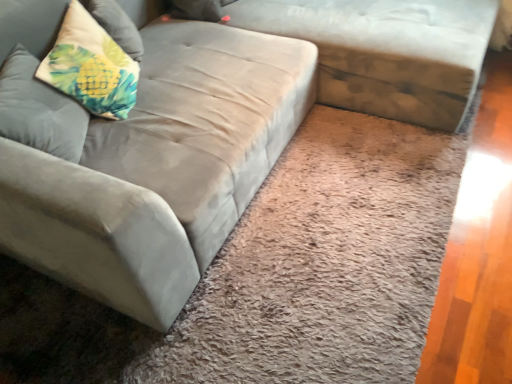
Question: Visually, is textured beige pillow at upper left, the first pillow viewed from the top, positioned to the left or to the right of suede gray couch at center?

Choices:
 (A) left
 (B) right

Answer: (A)

Question: From the image's perspective, is textured beige pillow at upper left, the first pillow viewed from the top, located above or below suede gray couch at center?

Choices:
 (A) above
 (B) below

Answer: (B)

Question: Which is farther from the fluffy fabric pillow at upper left, which is the second pillow from top to bottom?

Choices:
 (A) textured beige pillow at upper left, the first pillow viewed from the top
 (B) suede gray couch at center

Answer: (B)

Question: Estimate the real-world distances between objects in this image. Which object is closer to the fluffy fabric pillow at upper left, which is the second pillow from top to bottom?

Choices:
 (A) textured beige pillow at upper left, placed as the 2th pillow when sorted from bottom to top
 (B) suede gray couch at center

Answer: (A)